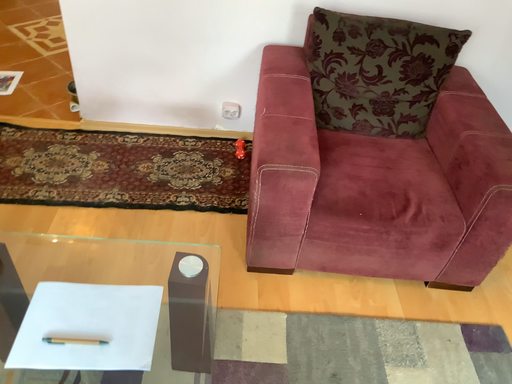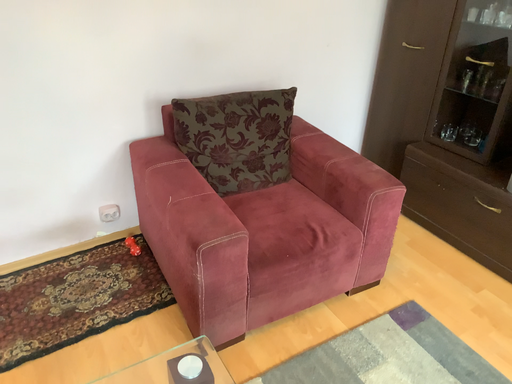
Question: Which way did the camera rotate in the video?

Choices:
 (A) rotated upward
 (B) rotated downward

Answer: (A)